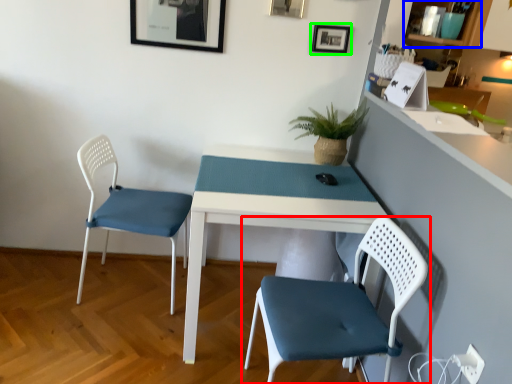
Question: Based on their relative distances, which object is nearer to chair (highlighted by a red box)? Choose from shelf (highlighted by a blue box) and picture frame (highlighted by a green box).

Choices:
 (A) shelf
 (B) picture frame

Answer: (B)